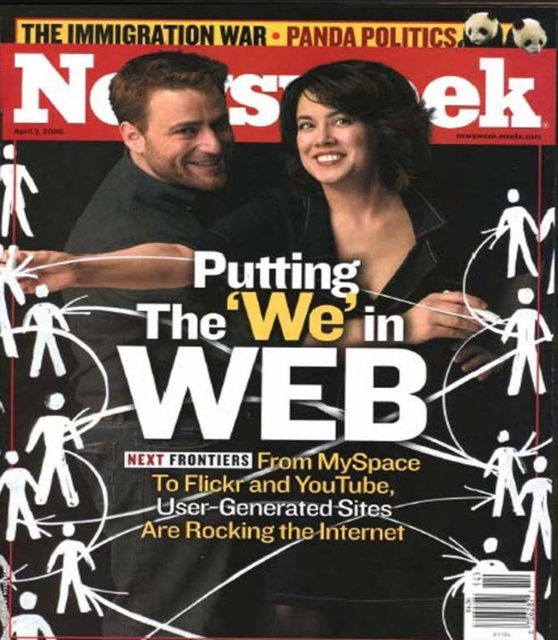
In the scene shown: Does black glossy hair at upper center have a smaller size compared to smooth black shirt at center?

Correct, black glossy hair at upper center occupies less space than smooth black shirt at center.

Where is `black glossy hair at upper center`? Image resolution: width=558 pixels, height=640 pixels. black glossy hair at upper center is located at coordinates (363, 204).